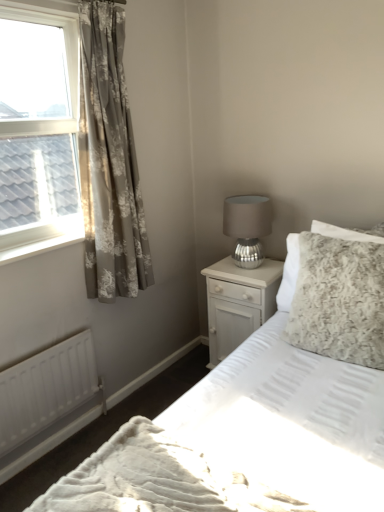
You are a GUI agent. You are given a task and a screenshot of the screen. Output one action in this format:
    pyautogui.click(x=<x>, y=<y>)
    Task: Click on the vacant area on top of white painted wood at left (from a real-world perspective)
    
    Given the screenshot: What is the action you would take?
    pyautogui.click(x=48, y=236)